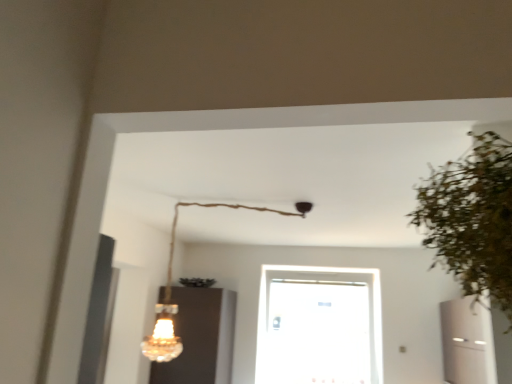
Question: Is transparent glass door at center taller or shorter than crystal glass chandelier at upper center?

Choices:
 (A) tall
 (B) short

Answer: (A)

Question: From the image's perspective, relative to crystal glass chandelier at upper center, is transparent glass door at center above or below?

Choices:
 (A) below
 (B) above

Answer: (A)

Question: Considering the real-world distances, which object is farthest from the green leafy plant at right?

Choices:
 (A) crystal glass chandelier at upper center
 (B) transparent glass door at center
 (C) matte glass cabinet at lower left
 (D) white glossy air conditioner at right

Answer: (B)

Question: Which object is the farthest from the green leafy plant at right?

Choices:
 (A) transparent glass door at center
 (B) matte glass cabinet at lower left
 (C) crystal glass chandelier at upper center
 (D) white glossy air conditioner at right

Answer: (A)